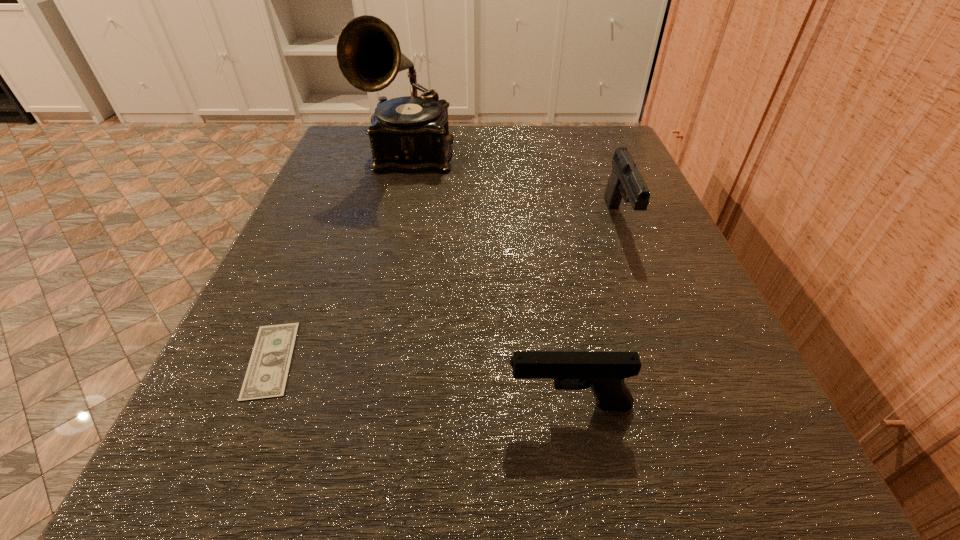
You are a GUI agent. You are given a task and a screenshot of the screen. Output one action in this format:
    pyautogui.click(x=<x>, y=<y>)
    Task: Click on the vacant space at the right edge of the desktop
    The height and width of the screenshot is (540, 960).
    Given the screenshot: What is the action you would take?
    pyautogui.click(x=749, y=383)

Find the location of a particular element. The image size is (960, 540). vacant space at the far left corner of the desktop is located at coordinates (356, 130).

Find the location of a particular element. The height and width of the screenshot is (540, 960). free space at the near left corner of the desktop is located at coordinates (324, 489).

Find the location of `vacant space at the far right corner`. vacant space at the far right corner is located at coordinates (610, 124).

Locate an element on the screen. Image resolution: width=960 pixels, height=540 pixels. free space between the tallest object and the shorter pistol is located at coordinates (490, 280).

The height and width of the screenshot is (540, 960). I want to click on free space between the money and the shorter pistol, so click(420, 382).

I want to click on free spot between the second object from right to left and the rightmost object, so click(594, 313).

Find the location of `vacant space that's between the shortest object and the phonograph record`. vacant space that's between the shortest object and the phonograph record is located at coordinates (341, 258).

The height and width of the screenshot is (540, 960). Find the location of `free space between the phonograph record and the nearer pistol`. free space between the phonograph record and the nearer pistol is located at coordinates 490,280.

At what (x,y) coordinates should I click in order to perform the action: click on unoccupied area between the shortest object and the rightmost object. Please return your answer as a coordinate pair (x, y). Looking at the image, I should click on (445, 291).